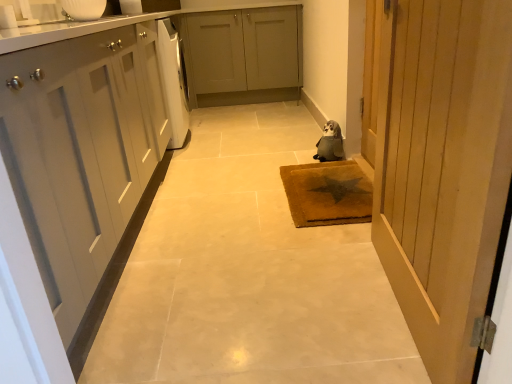
Question: Could you tell me if matte gray cabinets at center, the 2th cabinetry ordered from the bottom, is turned towards brown textured mat at center?

Choices:
 (A) yes
 (B) no

Answer: (A)

Question: Does matte gray cabinets at center, which appears as the 2th cabinetry when viewed from the front, appear on the right side of brown textured mat at center?

Choices:
 (A) no
 (B) yes

Answer: (A)

Question: Is matte gray cabinets at center, which appears as the 2th cabinetry when viewed from the front, positioned behind brown textured mat at center?

Choices:
 (A) yes
 (B) no

Answer: (A)

Question: From the image's perspective, is matte gray cabinets at center, which appears as the 2th cabinetry when viewed from the front, on brown textured mat at center?

Choices:
 (A) yes
 (B) no

Answer: (A)

Question: Can you confirm if matte gray cabinets at center, which appears as the 2th cabinetry when viewed from the front, is thinner than brown textured mat at center?

Choices:
 (A) no
 (B) yes

Answer: (B)

Question: Is wooden door at right spatially inside matte gray cabinets at center, placed as the 1th cabinetry when sorted from top to bottom, or outside of it?

Choices:
 (A) outside
 (B) inside

Answer: (A)

Question: From a real-world perspective, relative to matte gray cabinets at center, which appears as the 2th cabinetry when viewed from the front, is wooden door at right vertically above or below?

Choices:
 (A) below
 (B) above

Answer: (B)

Question: Is wooden door at right to the left or to the right of matte gray cabinets at center, placed as the 1th cabinetry when sorted from top to bottom, in the image?

Choices:
 (A) right
 (B) left

Answer: (A)

Question: From the image's perspective, relative to matte gray cabinets at center, which appears as the 2th cabinetry when viewed from the front, is wooden door at right above or below?

Choices:
 (A) below
 (B) above

Answer: (A)

Question: Is point (176, 82) closer or farther from the camera than point (244, 26)?

Choices:
 (A) farther
 (B) closer

Answer: (B)

Question: From their relative heights in the image, would you say white glossy dishwasher at left is taller or shorter than matte gray cabinets at center, which appears as the 2th cabinetry when viewed from the front?

Choices:
 (A) tall
 (B) short

Answer: (A)

Question: In terms of width, does white glossy dishwasher at left look wider or thinner when compared to matte gray cabinets at center, the 2th cabinetry ordered from the bottom?

Choices:
 (A) thin
 (B) wide

Answer: (A)

Question: Based on their positions, is white glossy dishwasher at left located to the left or right of matte gray cabinets at center, which appears as the 2th cabinetry when viewed from the front?

Choices:
 (A) right
 (B) left

Answer: (B)

Question: Considering the positions of point (330, 145) and point (453, 130), is point (330, 145) closer or farther from the camera than point (453, 130)?

Choices:
 (A) farther
 (B) closer

Answer: (A)

Question: Is gray plush toy at center inside or outside of wooden door at right?

Choices:
 (A) inside
 (B) outside

Answer: (B)